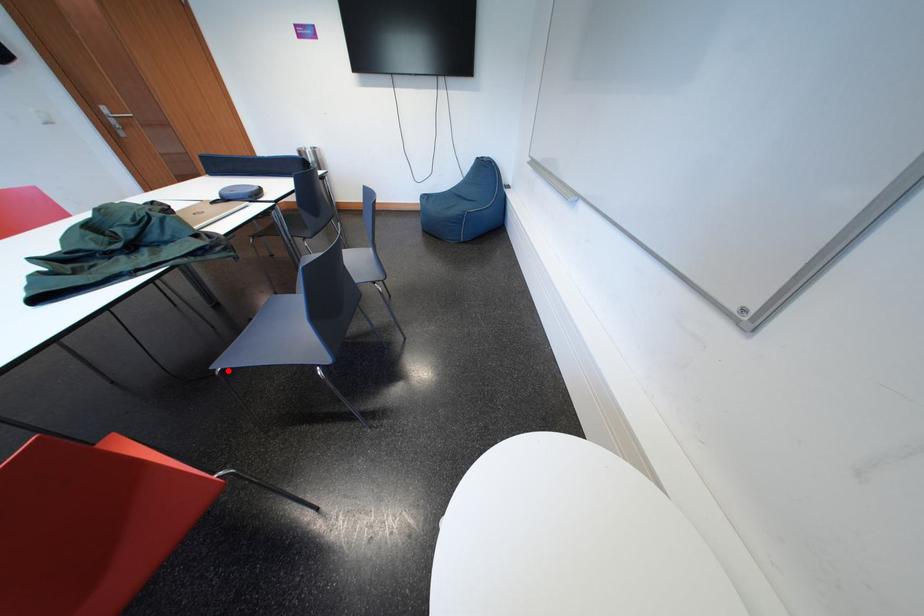
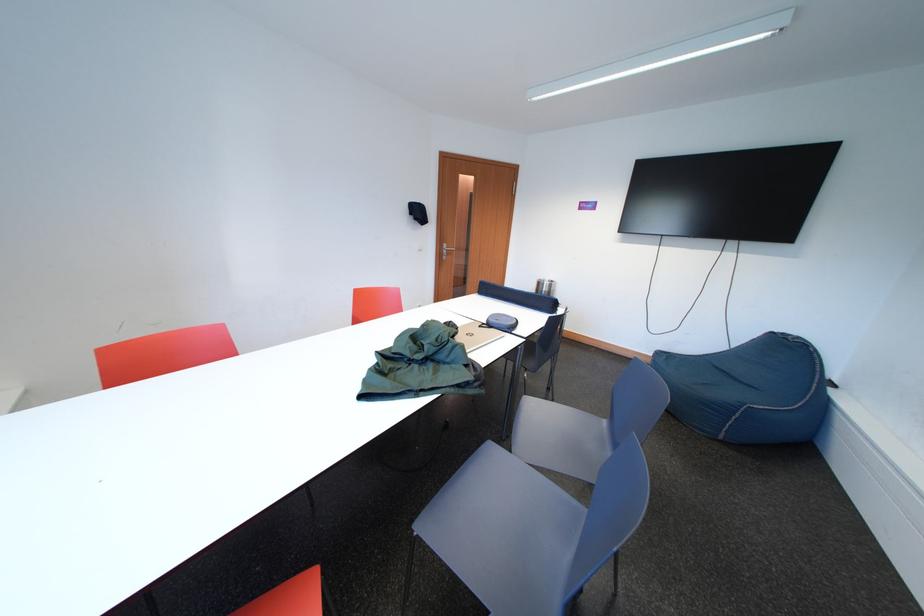
Question: I am providing you with two images of the same scene from different viewpoints. A red point is marked on the first image. At the location where the point appears in image 1, is it still visible in image 2?

Choices:
 (A) Yes
 (B) No

Answer: (A)